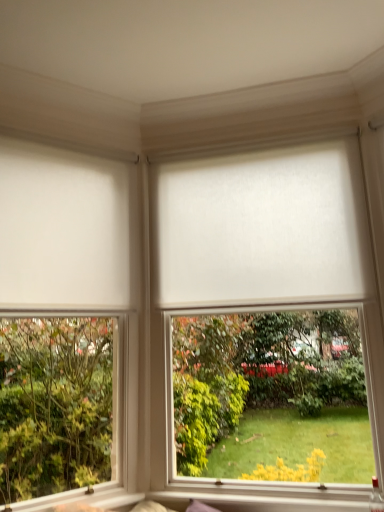
The width and height of the screenshot is (384, 512). What do you see at coordinates (264, 229) in the screenshot? I see `white matte blind at center, arranged as the second blind when viewed from the left` at bounding box center [264, 229].

This screenshot has height=512, width=384. What are the coordinates of `white matte roller blind at center, positioned as the 1th window in right-to-left order` in the screenshot? It's located at (271, 316).

At what (x,y) coordinates should I click in order to perform the action: click on white matte roller blind at left, the second window positioned from the right. Please return your answer as a coordinate pair (x, y). The width and height of the screenshot is (384, 512). Looking at the image, I should click on (67, 318).

At what (x,y) coordinates should I click in order to perform the action: click on white matte blind at left, positioned as the 2th blind in right-to-left order. Please return your answer as a coordinate pair (x, y). Looking at the image, I should click on (63, 229).

Which point is more distant from viewer, (x=127, y=175) or (x=267, y=289)?

The point (x=127, y=175) is behind.

From the image's perspective, which object appears higher, white matte roller blind at left, the second window positioned from the right, or white matte blind at center, arranged as the second blind when viewed from the left?

white matte blind at center, arranged as the second blind when viewed from the left, is shown above in the image.

Is white matte roller blind at left, the second window positioned from the right, to the left or to the right of white matte blind at center, the 1th blind from the right, in the image?

white matte roller blind at left, the second window positioned from the right, is to the left of white matte blind at center, the 1th blind from the right.

Is white matte roller blind at left, the second window positioned from the right, taller than white matte blind at center, arranged as the second blind when viewed from the left?

Yes, white matte roller blind at left, the second window positioned from the right, is taller than white matte blind at center, arranged as the second blind when viewed from the left.

Between point (303, 236) and point (23, 211), which one is positioned in front?

The point (23, 211) is closer.

Are white matte roller blind at center, positioned as the 1th window in right-to-left order, and white matte blind at left, the first blind viewed from the left, far apart?

No, white matte roller blind at center, positioned as the 1th window in right-to-left order, is not far from white matte blind at left, the first blind viewed from the left.

Considering the relative positions of white matte roller blind at center, positioned as the 2th window in left-to-right order, and white matte blind at left, the first blind viewed from the left, in the image provided, is white matte roller blind at center, positioned as the 2th window in left-to-right order, to the right of white matte blind at left, the first blind viewed from the left, from the viewer's perspective?

Yes, white matte roller blind at center, positioned as the 2th window in left-to-right order, is to the right of white matte blind at left, the first blind viewed from the left.

From the image's perspective, which is above, white matte roller blind at center, positioned as the 2th window in left-to-right order, or white matte roller blind at left, which ranks as the 1th window in left-to-right order?

white matte roller blind at center, positioned as the 2th window in left-to-right order, appears higher in the image.

I want to click on window above the white matte roller blind at left, which ranks as the 1th window in left-to-right order (from a real-world perspective), so click(271, 316).

Who is smaller, white matte roller blind at center, positioned as the 1th window in right-to-left order, or white matte roller blind at left, which ranks as the 1th window in left-to-right order?

Smaller between the two is white matte roller blind at left, which ranks as the 1th window in left-to-right order.

Considering the sizes of objects white matte blind at center, the 1th blind from the right, and white matte blind at left, the first blind viewed from the left, in the image provided, who is wider, white matte blind at center, the 1th blind from the right, or white matte blind at left, the first blind viewed from the left,?

Wider between the two is white matte blind at center, the 1th blind from the right.

Consider the image. From a real-world perspective, does white matte blind at center, arranged as the second blind when viewed from the left, sit lower than white matte blind at left, positioned as the 2th blind in right-to-left order?

No, from a real-world perspective, white matte blind at center, arranged as the second blind when viewed from the left, is not beneath white matte blind at left, positioned as the 2th blind in right-to-left order.

Considering the positions of objects white matte blind at center, the 1th blind from the right, and white matte blind at left, the first blind viewed from the left, in the image provided, who is in front, white matte blind at center, the 1th blind from the right, or white matte blind at left, the first blind viewed from the left,?

Positioned in front is white matte blind at left, the first blind viewed from the left.

In the scene shown: Is white matte blind at center, arranged as the second blind when viewed from the left, smaller than white matte blind at left, positioned as the 2th blind in right-to-left order?

No.

From a real-world perspective, is white matte blind at left, the first blind viewed from the left, on white matte roller blind at left, the second window positioned from the right?

Correct, in the physical world, white matte blind at left, the first blind viewed from the left, is higher than white matte roller blind at left, the second window positioned from the right.

How much distance is there between white matte blind at left, the first blind viewed from the left, and white matte roller blind at left, the second window positioned from the right?

white matte blind at left, the first blind viewed from the left, and white matte roller blind at left, the second window positioned from the right, are 1.22 meters apart.

How many degrees apart are the facing directions of white matte blind at left, positioned as the 2th blind in right-to-left order, and white matte roller blind at left, which ranks as the 1th window in left-to-right order?

0.00116 degrees.

Is white matte blind at left, the first blind viewed from the left, wider than white matte roller blind at left, which ranks as the 1th window in left-to-right order?

No, white matte blind at left, the first blind viewed from the left, is not wider than white matte roller blind at left, which ranks as the 1th window in left-to-right order.

Which is more to the left, white matte roller blind at center, positioned as the 2th window in left-to-right order, or white matte blind at center, the 1th blind from the right?

white matte blind at center, the 1th blind from the right.

Is white matte roller blind at center, positioned as the 2th window in left-to-right order, spatially inside white matte blind at center, the 1th blind from the right, or outside of it?

white matte roller blind at center, positioned as the 2th window in left-to-right order, is not enclosed by white matte blind at center, the 1th blind from the right.

How many degrees apart are the facing directions of white matte roller blind at center, positioned as the 2th window in left-to-right order, and white matte blind at center, the 1th blind from the right?

0.000356 degrees.

Considering the relative sizes of white matte roller blind at center, positioned as the 2th window in left-to-right order, and white matte blind at center, arranged as the second blind when viewed from the left, in the image provided, is white matte roller blind at center, positioned as the 2th window in left-to-right order, taller than white matte blind at center, arranged as the second blind when viewed from the left,?

Correct, white matte roller blind at center, positioned as the 2th window in left-to-right order, is much taller as white matte blind at center, arranged as the second blind when viewed from the left.

Is white matte roller blind at left, the second window positioned from the right, inside or outside of white matte blind at left, positioned as the 2th blind in right-to-left order?

white matte roller blind at left, the second window positioned from the right, is located beyond the bounds of white matte blind at left, positioned as the 2th blind in right-to-left order.

Considering the sizes of white matte roller blind at left, the second window positioned from the right, and white matte blind at left, the first blind viewed from the left, in the image, is white matte roller blind at left, the second window positioned from the right, taller or shorter than white matte blind at left, the first blind viewed from the left,?

Clearly, white matte roller blind at left, the second window positioned from the right, is taller compared to white matte blind at left, the first blind viewed from the left.

Is white matte roller blind at left, which ranks as the 1th window in left-to-right order, facing towards white matte blind at left, the first blind viewed from the left?

Yes, white matte roller blind at left, which ranks as the 1th window in left-to-right order, is oriented towards white matte blind at left, the first blind viewed from the left.

Identify the location of the 2nd window in front of the white matte blind at center, the 1th blind from the right, starting your count from the anchor. The image size is (384, 512). (67, 318).

Where is `blind that is the 1st one when counting upward from the white matte roller blind at center, positioned as the 1th window in right-to-left order (from the image's perspective)`? Image resolution: width=384 pixels, height=512 pixels. blind that is the 1st one when counting upward from the white matte roller blind at center, positioned as the 1th window in right-to-left order (from the image's perspective) is located at coordinates (63, 229).

Based on the photo, considering their positions, is white matte blind at left, positioned as the 2th blind in right-to-left order, positioned further to white matte blind at center, arranged as the second blind when viewed from the left, than white matte roller blind at left, which ranks as the 1th window in left-to-right order?

white matte roller blind at left, which ranks as the 1th window in left-to-right order, is positioned further to the anchor white matte blind at center, arranged as the second blind when viewed from the left.

Looking at the image, which one is located closer to white matte blind at center, arranged as the second blind when viewed from the left, white matte roller blind at left, which ranks as the 1th window in left-to-right order, or white matte blind at left, the first blind viewed from the left?

white matte blind at left, the first blind viewed from the left, is closer to white matte blind at center, arranged as the second blind when viewed from the left.

When comparing their distances from white matte roller blind at left, the second window positioned from the right, does white matte roller blind at center, positioned as the 2th window in left-to-right order, or white matte blind at center, arranged as the second blind when viewed from the left, seem further?

Based on the image, white matte blind at center, arranged as the second blind when viewed from the left, appears to be further to white matte roller blind at left, the second window positioned from the right.

When comparing their distances from white matte roller blind at left, which ranks as the 1th window in left-to-right order, does white matte blind at center, arranged as the second blind when viewed from the left, or white matte blind at left, the first blind viewed from the left, seem further?

Among the two, white matte blind at center, arranged as the second blind when viewed from the left, is located further to white matte roller blind at left, which ranks as the 1th window in left-to-right order.

Which object lies further to the anchor point white matte roller blind at center, positioned as the 2th window in left-to-right order, white matte blind at center, the 1th blind from the right, or white matte roller blind at left, the second window positioned from the right?

Based on the image, white matte roller blind at left, the second window positioned from the right, appears to be further to white matte roller blind at center, positioned as the 2th window in left-to-right order.

Based on their spatial positions, is white matte blind at center, the 1th blind from the right, or white matte roller blind at left, the second window positioned from the right, closer to white matte blind at left, positioned as the 2th blind in right-to-left order?

white matte blind at center, the 1th blind from the right, lies closer to white matte blind at left, positioned as the 2th blind in right-to-left order, than the other object.

Which object lies further to the anchor point white matte blind at left, positioned as the 2th blind in right-to-left order, white matte roller blind at left, the second window positioned from the right, or white matte roller blind at center, positioned as the 2th window in left-to-right order?

Based on the image, white matte roller blind at left, the second window positioned from the right, appears to be further to white matte blind at left, positioned as the 2th blind in right-to-left order.

Which object lies nearer to the anchor point white matte blind at center, the 1th blind from the right, white matte roller blind at center, positioned as the 2th window in left-to-right order, or white matte blind at left, positioned as the 2th blind in right-to-left order?

white matte roller blind at center, positioned as the 2th window in left-to-right order, is closer to white matte blind at center, the 1th blind from the right.

Where is `blind situated between white matte roller blind at left, the second window positioned from the right, and white matte roller blind at center, positioned as the 1th window in right-to-left order, from left to right`? This screenshot has height=512, width=384. blind situated between white matte roller blind at left, the second window positioned from the right, and white matte roller blind at center, positioned as the 1th window in right-to-left order, from left to right is located at coordinates point(264,229).

Where is `blind between white matte blind at left, positioned as the 2th blind in right-to-left order, and white matte roller blind at center, positioned as the 2th window in left-to-right order, in the horizontal direction`? Image resolution: width=384 pixels, height=512 pixels. blind between white matte blind at left, positioned as the 2th blind in right-to-left order, and white matte roller blind at center, positioned as the 2th window in left-to-right order, in the horizontal direction is located at coordinates (264, 229).

Locate an element on the screen. window between white matte blind at left, the first blind viewed from the left, and white matte blind at center, the 1th blind from the right, from left to right is located at coordinates (67, 318).

Where is `window between white matte blind at left, positioned as the 2th blind in right-to-left order, and white matte roller blind at center, positioned as the 2th window in left-to-right order, in the horizontal direction`? window between white matte blind at left, positioned as the 2th blind in right-to-left order, and white matte roller blind at center, positioned as the 2th window in left-to-right order, in the horizontal direction is located at coordinates (67, 318).